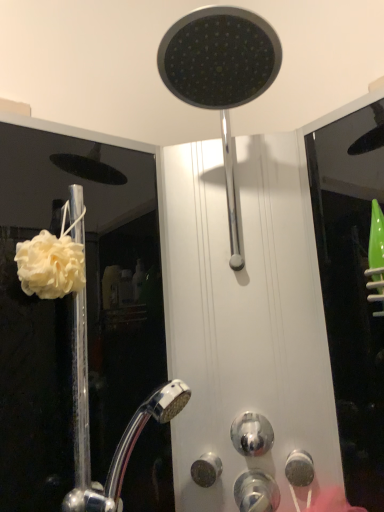
Question: Is satin nickel knob at lower center, arranged as the 3th knob when viewed from the right, bigger or smaller than shiny metallic knob at center, the 2th knob when ordered from left to right?

Choices:
 (A) small
 (B) big

Answer: (A)

Question: Considering the positions of satin nickel knob at lower center, arranged as the 3th knob when viewed from the right, and shiny metallic knob at center, the 2th knob when ordered from left to right, in the image, is satin nickel knob at lower center, arranged as the 3th knob when viewed from the right, taller or shorter than shiny metallic knob at center, the 2th knob when ordered from left to right,?

Choices:
 (A) short
 (B) tall

Answer: (A)

Question: Which object is positioned farthest from the white matte shower curtain at left?

Choices:
 (A) shiny metallic knob at center, which is the second knob from right to left
 (B) matte black shower head at upper center
 (C) white fluffy sponge at left
 (D) satin nickel knob at lower center, arranged as the 3th knob when viewed from the right
 (E) satin nickel knob at lower right, the first knob when ordered from right to left

Answer: (E)

Question: Based on their relative distances, which object is nearer to the white fluffy sponge at left?

Choices:
 (A) satin nickel knob at lower right, the third knob when ordered from left to right
 (B) satin nickel knob at lower center, marked as the first knob in a left-to-right arrangement
 (C) shiny metallic knob at center, the 2th knob when ordered from left to right
 (D) matte black shower head at upper center
 (E) white matte shower curtain at left

Answer: (D)